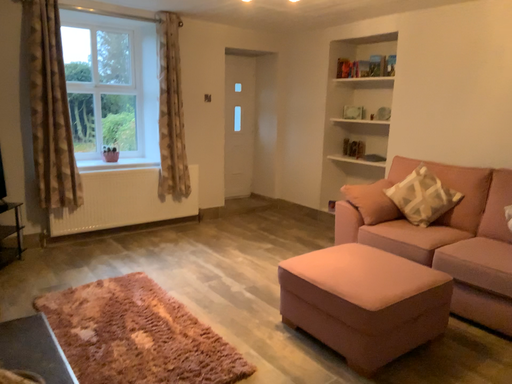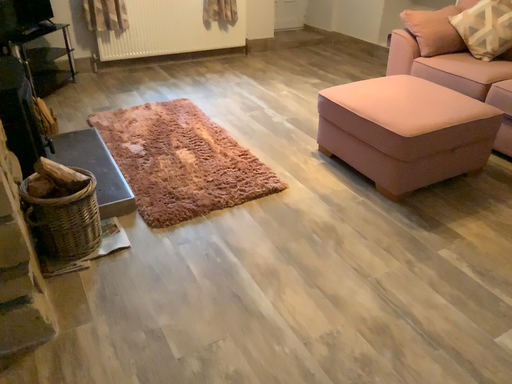
Question: How did the camera likely rotate when shooting the video?

Choices:
 (A) rotated right
 (B) rotated left

Answer: (B)